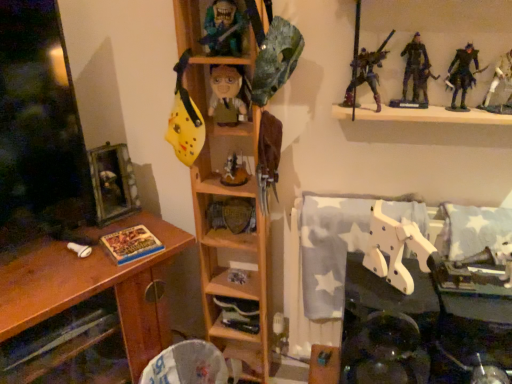
Question: From the image's perspective, does dark gray plastic figure at upper right, which appears as the second toy when viewed from the top, appear higher than wooden shelf at center, the 3th shelf positioned from the right?

Choices:
 (A) yes
 (B) no

Answer: (A)

Question: Does dark gray plastic figure at upper right, which appears as the second toy when viewed from the top, turn towards wooden shelf at center, which is the 2th shelf from left to right?

Choices:
 (A) no
 (B) yes

Answer: (A)

Question: Is dark gray plastic figure at upper right, marked as the 2th toy in a right-to-left arrangement, positioned with its back to wooden shelf at center, which is the 2th shelf from left to right?

Choices:
 (A) yes
 (B) no

Answer: (B)

Question: Can you confirm if dark gray plastic figure at upper right, which is the fourth toy from left to right, is taller than wooden shelf at center, which is the 2th shelf from left to right?

Choices:
 (A) no
 (B) yes

Answer: (A)

Question: Considering the relative sizes of dark gray plastic figure at upper right, which is the fourth toy from left to right, and wooden shelf at center, which is the 2th shelf from left to right, in the image provided, is dark gray plastic figure at upper right, which is the fourth toy from left to right, thinner than wooden shelf at center, which is the 2th shelf from left to right,?

Choices:
 (A) no
 (B) yes

Answer: (B)

Question: From a real-world perspective, relative to dark blue fabric figure at upper right, the 3th person in the left-to-right sequence, is white wood robot at lower right, which is counted as the third toy, starting from the left, vertically above or below?

Choices:
 (A) below
 (B) above

Answer: (A)

Question: Based on their positions, is white wood robot at lower right, acting as the 1th toy starting from the bottom, located to the left or right of dark blue fabric figure at upper right, the 3th person in the left-to-right sequence?

Choices:
 (A) left
 (B) right

Answer: (A)

Question: From the image's perspective, is white wood robot at lower right, arranged as the fifth toy when viewed from the top, above or below dark blue fabric figure at upper right, the 3th person in the left-to-right sequence?

Choices:
 (A) below
 (B) above

Answer: (A)

Question: Based on their sizes in the image, would you say white wood robot at lower right, arranged as the fifth toy when viewed from the top, is bigger or smaller than dark blue fabric figure at upper right, the 3th person in the left-to-right sequence?

Choices:
 (A) small
 (B) big

Answer: (B)

Question: Is dark blue fabric figure at upper right, the 3th person in the left-to-right sequence, situated inside dark gray plastic figure at upper right, arranged as the fourth toy when ordered from the bottom, or outside?

Choices:
 (A) inside
 (B) outside

Answer: (B)

Question: Is dark blue fabric figure at upper right, which appears as the first person when viewed from the right, taller or shorter than dark gray plastic figure at upper right, arranged as the fourth toy when ordered from the bottom?

Choices:
 (A) short
 (B) tall

Answer: (A)

Question: In terms of size, does dark blue fabric figure at upper right, which appears as the first person when viewed from the right, appear bigger or smaller than dark gray plastic figure at upper right, marked as the 2th toy in a right-to-left arrangement?

Choices:
 (A) small
 (B) big

Answer: (A)

Question: From a real-world perspective, is dark blue fabric figure at upper right, which appears as the first person when viewed from the right, above or below dark gray plastic figure at upper right, marked as the 2th toy in a right-to-left arrangement?

Choices:
 (A) below
 (B) above

Answer: (A)

Question: From a real-world perspective, is brown wood desk at left physically located above or below wooden framed picture at left?

Choices:
 (A) above
 (B) below

Answer: (B)

Question: Considering the positions of brown wood desk at left and wooden framed picture at left in the image, is brown wood desk at left wider or thinner than wooden framed picture at left?

Choices:
 (A) wide
 (B) thin

Answer: (A)